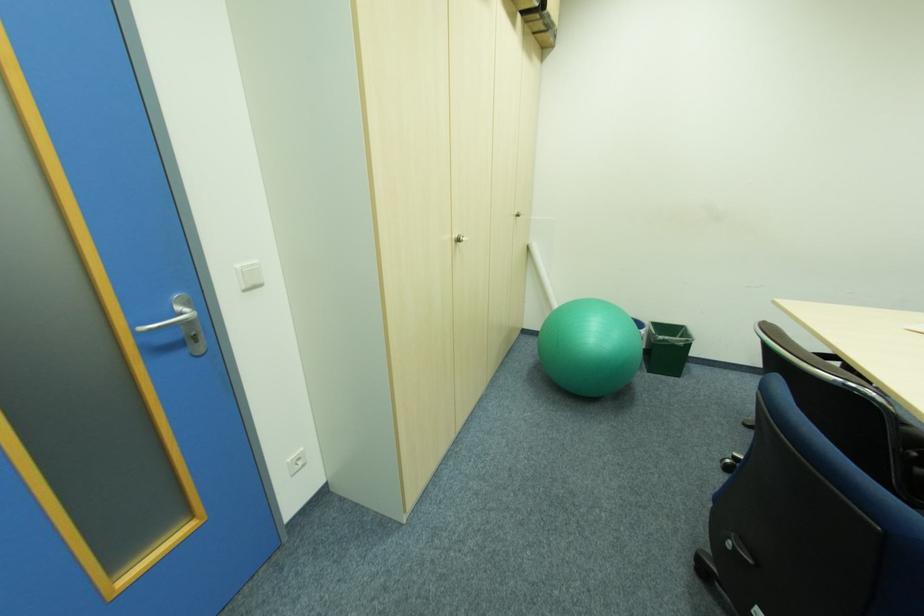
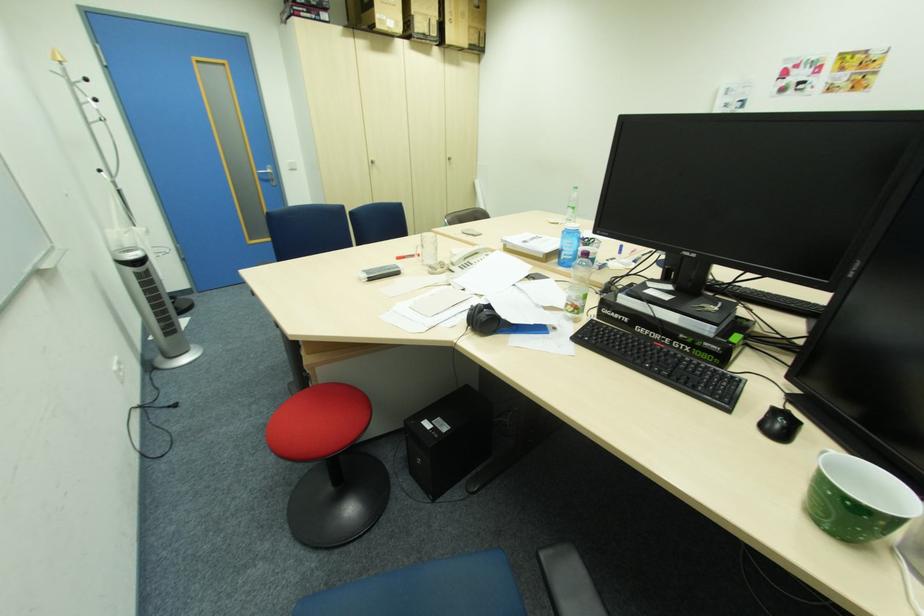
In the second image, find the point that corresponds to the point at 523,216 in the first image.

(456, 159)